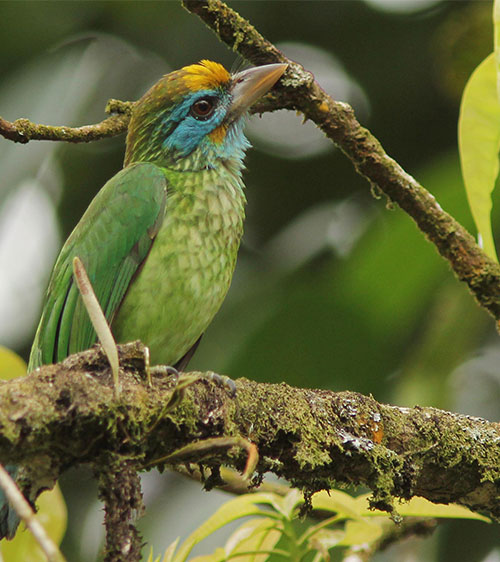
The image size is (500, 562). Identify the location of light green chest. (198, 267).